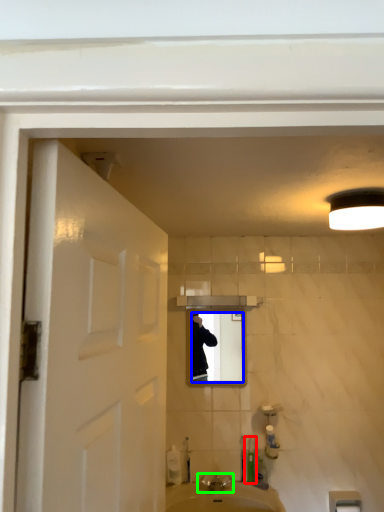
Question: Considering the real-world distances, which object is farthest from toiletry (highlighted by a red box)? mirror (highlighted by a blue box) or tap (highlighted by a green box)?

Choices:
 (A) mirror
 (B) tap

Answer: (A)